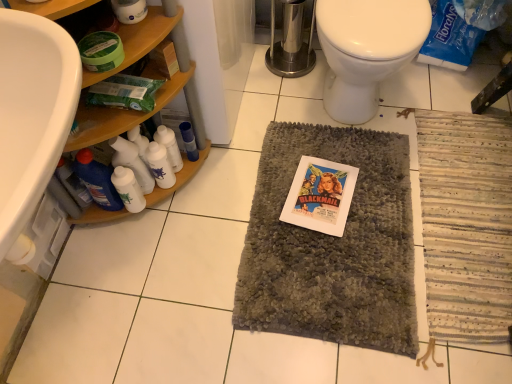
Where is `free area in between white plastic bottles at left, which is the 2th bottle in right-to-left order, and striped fabric bath mat at lower right`? free area in between white plastic bottles at left, which is the 2th bottle in right-to-left order, and striped fabric bath mat at lower right is located at coordinates (350, 212).